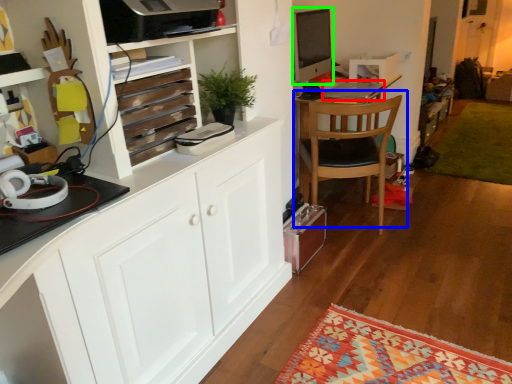
Question: Estimate the real-world distances between objects in this image. Which object is farther from laptop (highlighted by a red box), chair (highlighted by a blue box) or desktop computer (highlighted by a green box)?

Choices:
 (A) chair
 (B) desktop computer

Answer: (B)